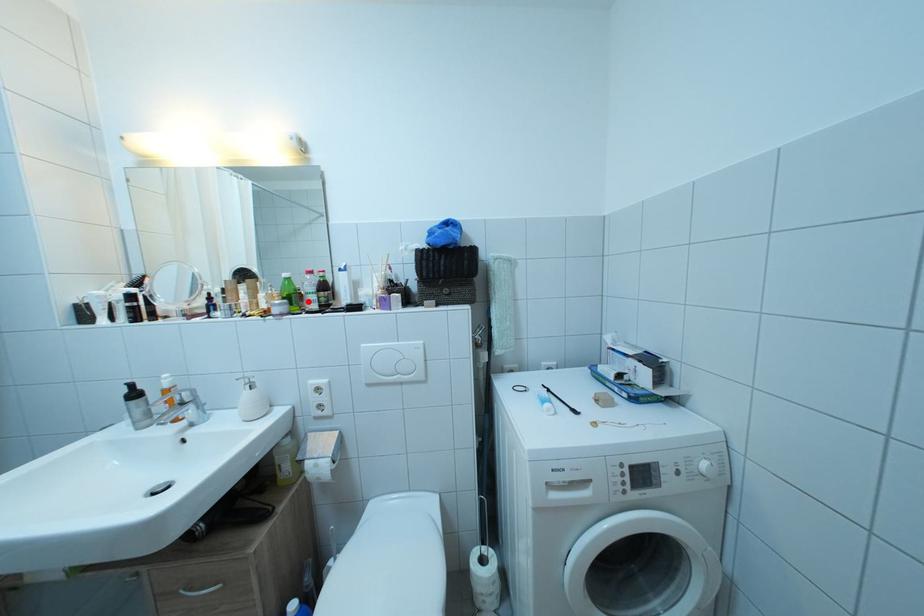
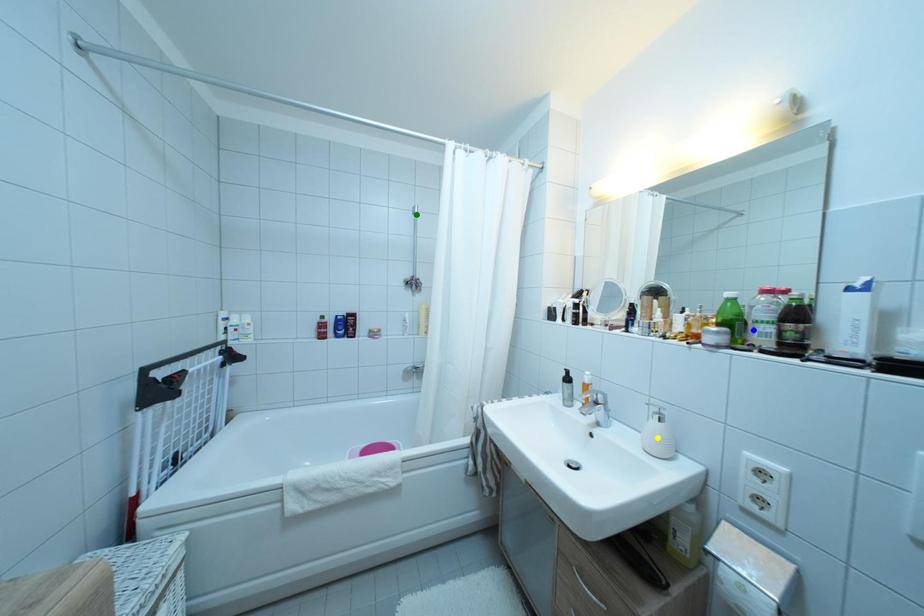
Question: I am providing you with two images of the same scene from different viewpoints. A red point is marked on the first image. You are given multiple points on the second image. Which point in image 2 is actually the same real-world point as the red point in image 1?

Choices:
 (A) blue point
 (B) yellow point
 (C) green point

Answer: (A)